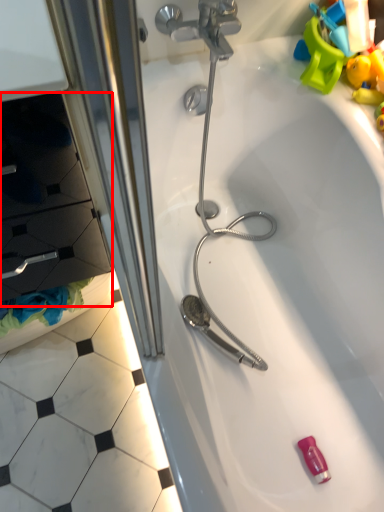
Question: From the image, what is the correct spatial relationship of drawer (annotated by the red box) in relation to bathtub?

Choices:
 (A) right
 (B) left

Answer: (B)